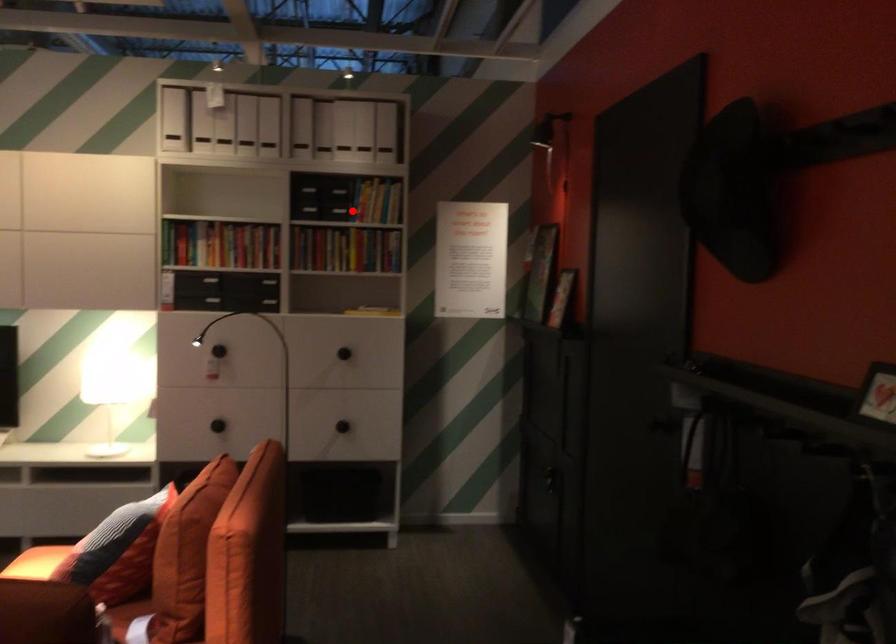
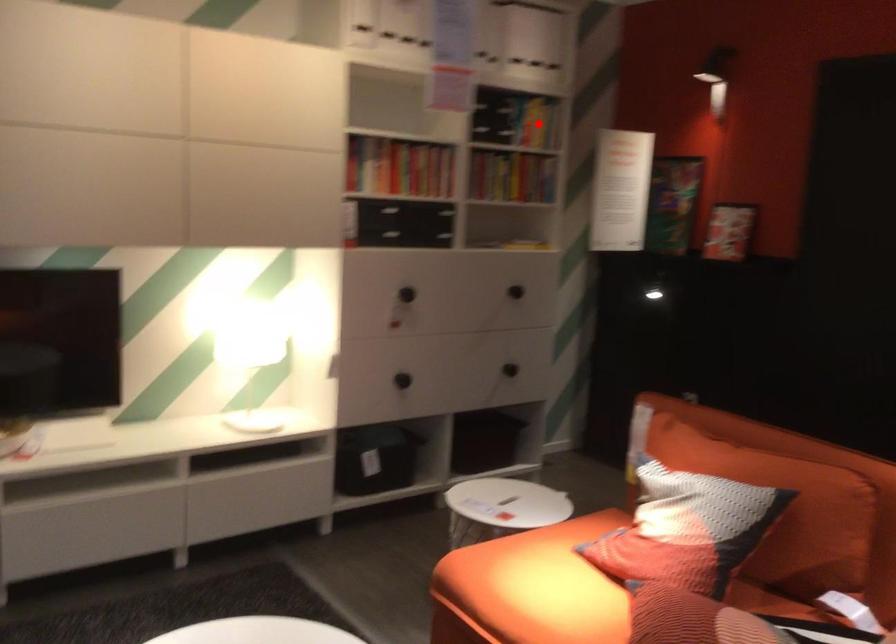
I am providing you with two images of the same scene from different viewpoints. A red point is marked on the first image and another point is marked on the second image. Is the red point in image1 aligned with the point shown in image2?

Yes